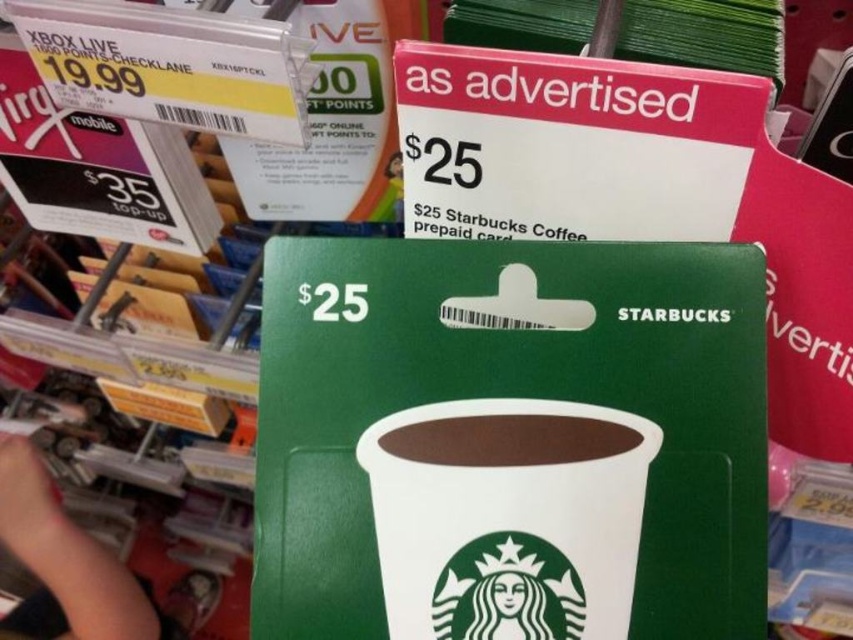
Question: Estimate the real-world distances between objects in this image. Which object is farther from the green matte starbucks prepaid card at center?

Choices:
 (A) brown matte cup at center
 (B) white paper cup at center

Answer: (A)

Question: Can you confirm if green matte starbucks prepaid card at center is positioned to the right of white paper cup at center?

Choices:
 (A) no
 (B) yes

Answer: (A)

Question: Which object appears closest to the camera in this image?

Choices:
 (A) green matte starbucks prepaid card at center
 (B) white paper cup at center
 (C) brown matte cup at center

Answer: (A)

Question: Can you confirm if green matte starbucks prepaid card at center is bigger than brown matte cup at center?

Choices:
 (A) yes
 (B) no

Answer: (A)

Question: Which point is farther to the camera?

Choices:
 (A) (425, 440)
 (B) (273, 556)

Answer: (A)

Question: Does green matte starbucks prepaid card at center come in front of brown matte cup at center?

Choices:
 (A) no
 (B) yes

Answer: (B)